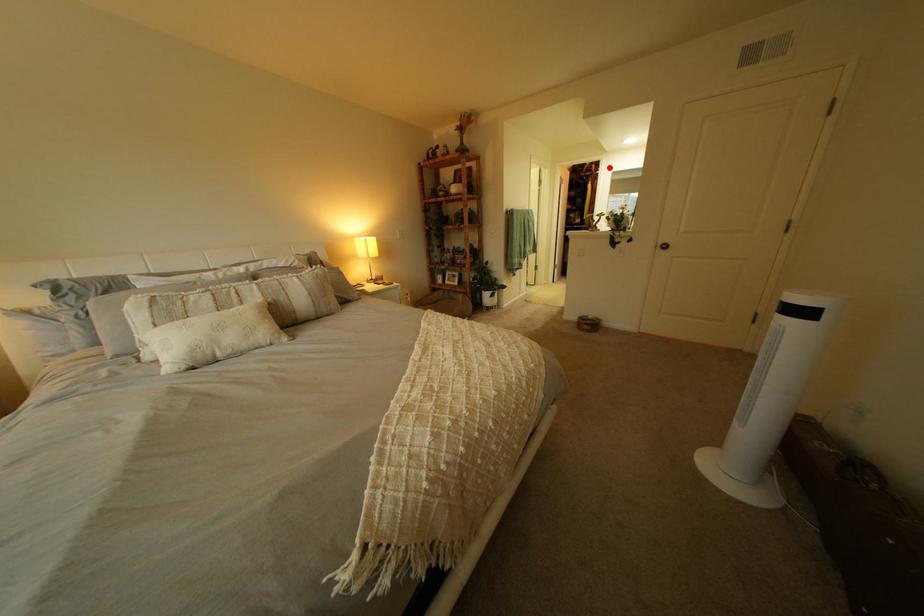
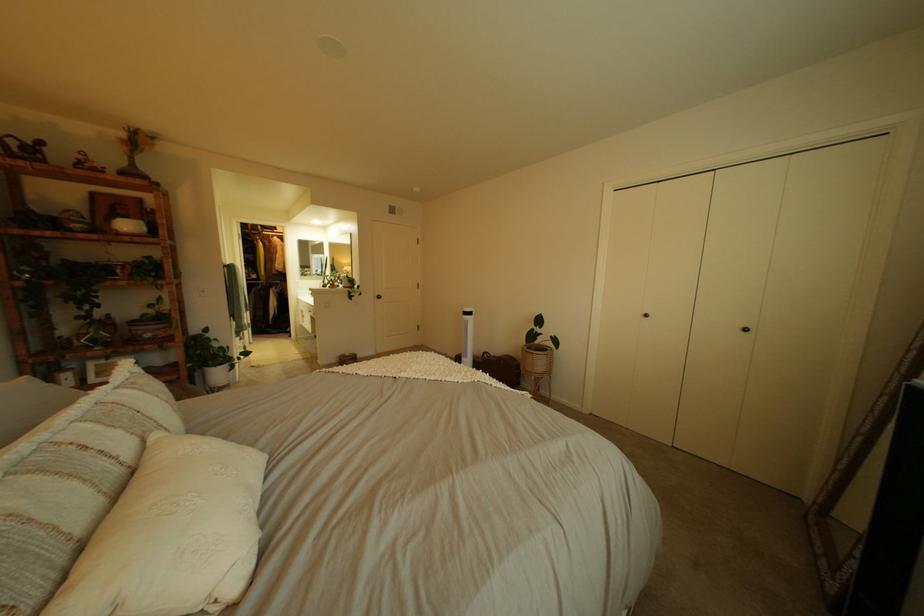
Question: I am providing you with two images of the same scene from different viewpoints. A red point is shown in image1. For the corresponding object point in image2, is it positioned nearer or farther from the camera?

Choices:
 (A) Nearer
 (B) Farther

Answer: (B)